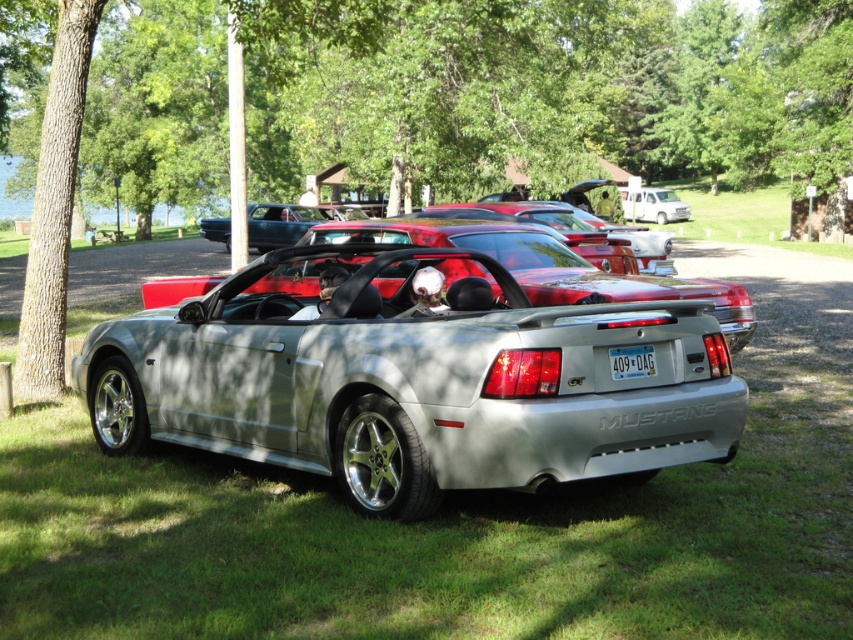
Can you confirm if white matte van at upper center is taller than white plastic license plate at center?

Yes, white matte van at upper center is taller than white plastic license plate at center.

Who is more forward, (663, 195) or (630, 376)?

Point (630, 376) is more forward.

This screenshot has width=853, height=640. I want to click on white matte van at upper center, so point(653,205).

Can you confirm if green grass at center is bigger than white matte van at upper center?

Yes, green grass at center is bigger than white matte van at upper center.

Between green grass at center and white matte van at upper center, which one appears on the left side from the viewer's perspective?

From the viewer's perspective, green grass at center appears more on the left side.

Locate an element on the screen. green grass at center is located at coordinates (473, 509).

Find the location of a particular element. This screenshot has width=853, height=640. green grass at center is located at coordinates (473, 509).

The image size is (853, 640). Describe the element at coordinates (412, 381) in the screenshot. I see `silver metallic convertible at center` at that location.

Is silver metallic convertible at center closer to the viewer compared to white matte van at upper center?

That is True.

Which is behind, point (384, 332) or point (682, 209)?

The point (682, 209) is more distant.

The image size is (853, 640). Identify the location of silver metallic convertible at center. (412, 381).